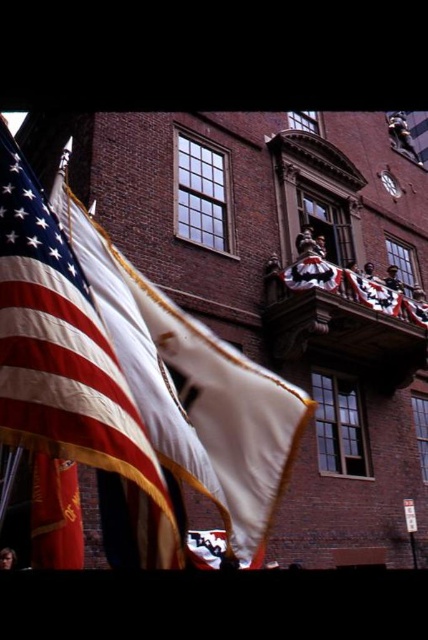
Is matte white flag at left further to camera compared to american flag at center?

No, it is not.

Measure the distance between matte white flag at left and camera.

matte white flag at left and camera are 28.68 meters apart from each other.

I want to click on matte white flag at left, so click(x=71, y=392).

Does decorative wood balcony at upper center have a greater width compared to red satin flag at lower left?

Correct, the width of decorative wood balcony at upper center exceeds that of red satin flag at lower left.

Who is lower down, decorative wood balcony at upper center or red satin flag at lower left?

red satin flag at lower left is lower down.

Who is more forward, (371, 284) or (82, 538)?

Point (82, 538)

Find the location of a particular element. This screenshot has width=428, height=640. decorative wood balcony at upper center is located at coordinates (341, 323).

Is the position of matte white flag at left more distant than that of decorative wood balcony at upper center?

That is False.

Consider the image. Can you confirm if matte white flag at left is wider than decorative wood balcony at upper center?

In fact, matte white flag at left might be narrower than decorative wood balcony at upper center.

Image resolution: width=428 pixels, height=640 pixels. What do you see at coordinates (71, 392) in the screenshot? I see `matte white flag at left` at bounding box center [71, 392].

Locate an element on the screen. The width and height of the screenshot is (428, 640). matte white flag at left is located at coordinates (71, 392).